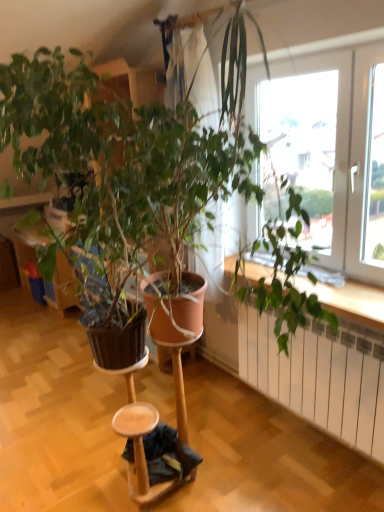
Question: Is white metallic radiator at lower right oriented towards wooden step stool at lower center?

Choices:
 (A) yes
 (B) no

Answer: (A)

Question: Is white metallic radiator at lower right not within wooden step stool at lower center?

Choices:
 (A) no
 (B) yes

Answer: (B)

Question: From the image's perspective, is white metallic radiator at lower right located beneath wooden step stool at lower center?

Choices:
 (A) no
 (B) yes

Answer: (A)

Question: Is white metallic radiator at lower right far from wooden step stool at lower center?

Choices:
 (A) yes
 (B) no

Answer: (B)

Question: Is the position of white metallic radiator at lower right more distant than that of wooden step stool at lower center?

Choices:
 (A) no
 (B) yes

Answer: (A)

Question: Is white metallic radiator at lower right surrounding wooden step stool at lower center?

Choices:
 (A) yes
 (B) no

Answer: (B)

Question: Does wooden step stool at lower center come behind white metallic radiator at lower right?

Choices:
 (A) yes
 (B) no

Answer: (A)

Question: Considering the relative sizes of wooden step stool at lower center and white metallic radiator at lower right in the image provided, is wooden step stool at lower center shorter than white metallic radiator at lower right?

Choices:
 (A) no
 (B) yes

Answer: (B)

Question: From a real-world perspective, is wooden step stool at lower center beneath white metallic radiator at lower right?

Choices:
 (A) yes
 (B) no

Answer: (A)

Question: From the image's perspective, is wooden step stool at lower center on top of white metallic radiator at lower right?

Choices:
 (A) yes
 (B) no

Answer: (B)

Question: Does wooden step stool at lower center have a greater height compared to white metallic radiator at lower right?

Choices:
 (A) yes
 (B) no

Answer: (B)

Question: Is wooden step stool at lower center to the left of white metallic radiator at lower right from the viewer's perspective?

Choices:
 (A) no
 (B) yes

Answer: (B)

Question: Considering the positions of white metallic radiator at lower right and wooden step stool at lower center in the image, is white metallic radiator at lower right taller or shorter than wooden step stool at lower center?

Choices:
 (A) short
 (B) tall

Answer: (B)